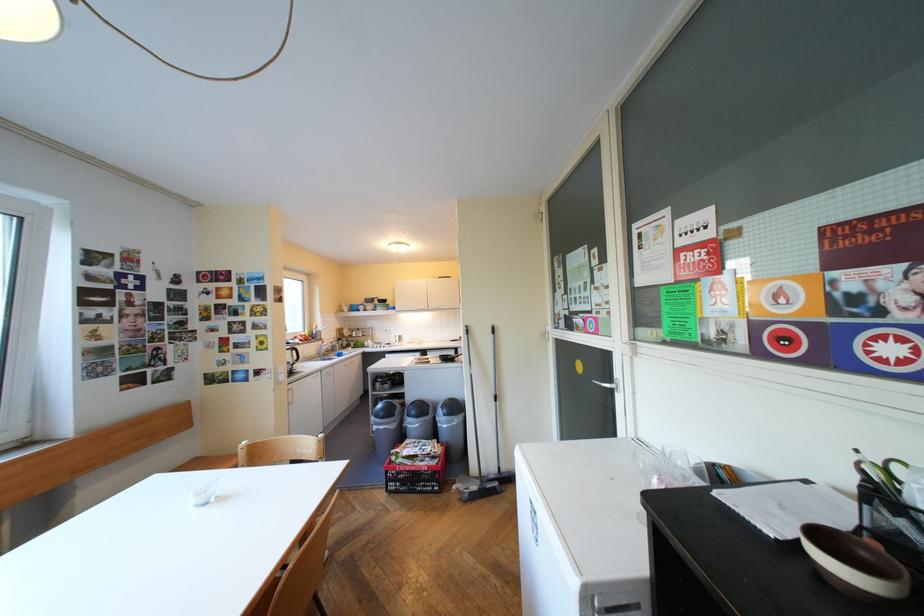
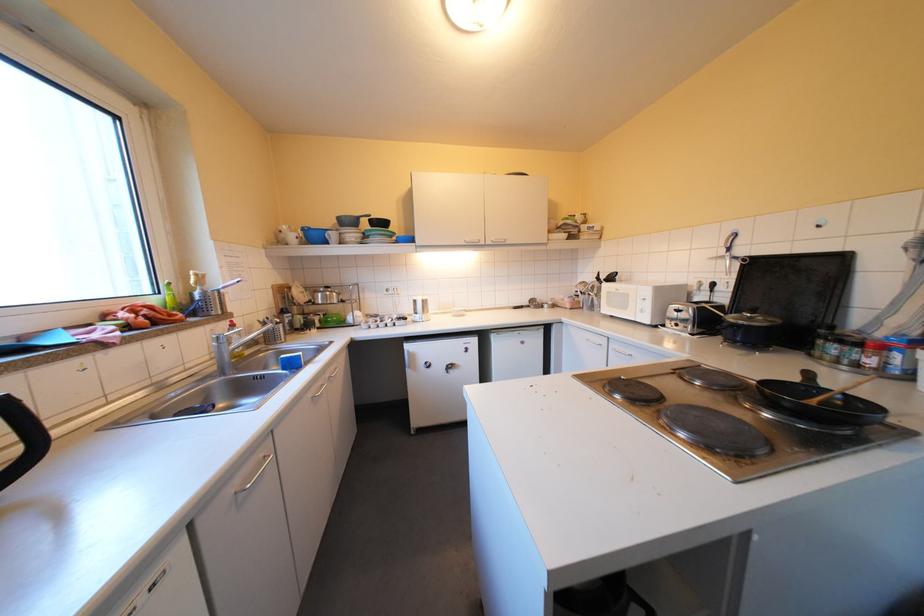
The point at (359, 307) is marked in the first image. Where is the corresponding point in the second image?

(305, 236)